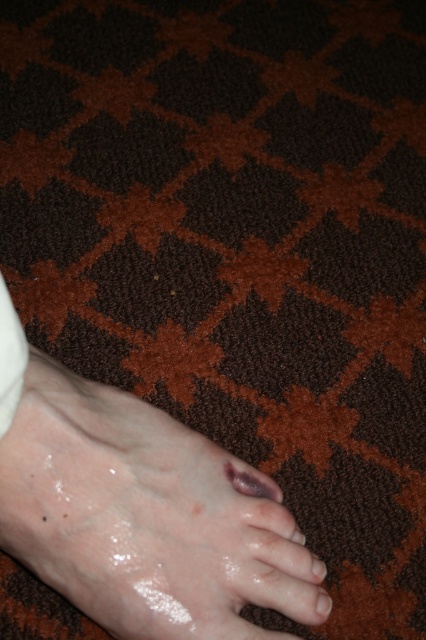
Question: Does purple matte toe at lower center have a greater width compared to matte brown toe at lower center?

Choices:
 (A) no
 (B) yes

Answer: (B)

Question: Is purple matte toe at lower center wider than glossy pink toe at lower left?

Choices:
 (A) yes
 (B) no

Answer: (A)

Question: Based on their relative distances, which object is nearer to the matte brown toe at lower center?

Choices:
 (A) slick skin foot at lower center
 (B) purple matte toe at lower center
 (C) glossy pink toe at lower left

Answer: (C)

Question: Which is nearer to the matte brown toe at lower center?

Choices:
 (A) glossy pink toe at lower left
 (B) purple matte toe at lower center
 (C) slick skin foot at lower center

Answer: (A)

Question: Among these objects, which one is nearest to the camera?

Choices:
 (A) purple matte toe at lower center
 (B) glossy pink toe at lower left

Answer: (A)

Question: Can you confirm if slick skin foot at lower center is positioned above matte brown toe at lower center?

Choices:
 (A) no
 (B) yes

Answer: (B)